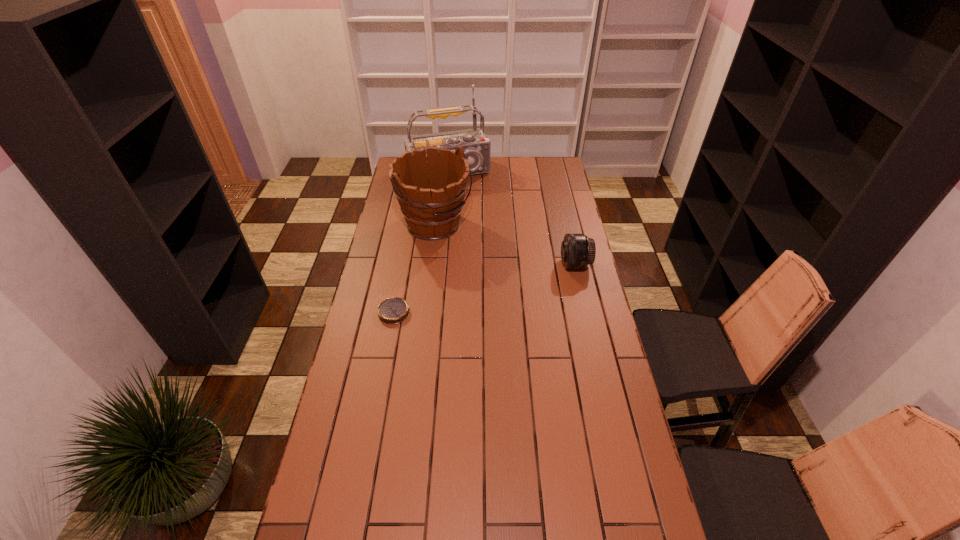
Image resolution: width=960 pixels, height=540 pixels. In order to click on wine bucket that is at the left edge in this screenshot , I will do `click(432, 207)`.

Locate an element on the screen. The image size is (960, 540). radio receiver located at the left edge is located at coordinates (476, 146).

The height and width of the screenshot is (540, 960). I want to click on object at the right edge, so click(x=577, y=250).

Identify the location of object positioned at the far left corner. The image size is (960, 540). (476, 146).

This screenshot has height=540, width=960. In the image, there is a desktop. Identify the location of vacant space at the far edge. (503, 162).

This screenshot has width=960, height=540. In order to click on vacant space at the near edge of the desktop in this screenshot , I will do `click(440, 535)`.

Where is `vacant region at the left edge of the desktop`? The height and width of the screenshot is (540, 960). vacant region at the left edge of the desktop is located at coordinates (363, 466).

Locate an element on the screen. vacant area at the right edge of the desktop is located at coordinates (570, 390).

I want to click on free space between the farthest object and the second shortest object, so click(x=512, y=218).

In order to click on unoccupied area between the telephoto lens and the farthest object in this screenshot , I will do `click(512, 218)`.